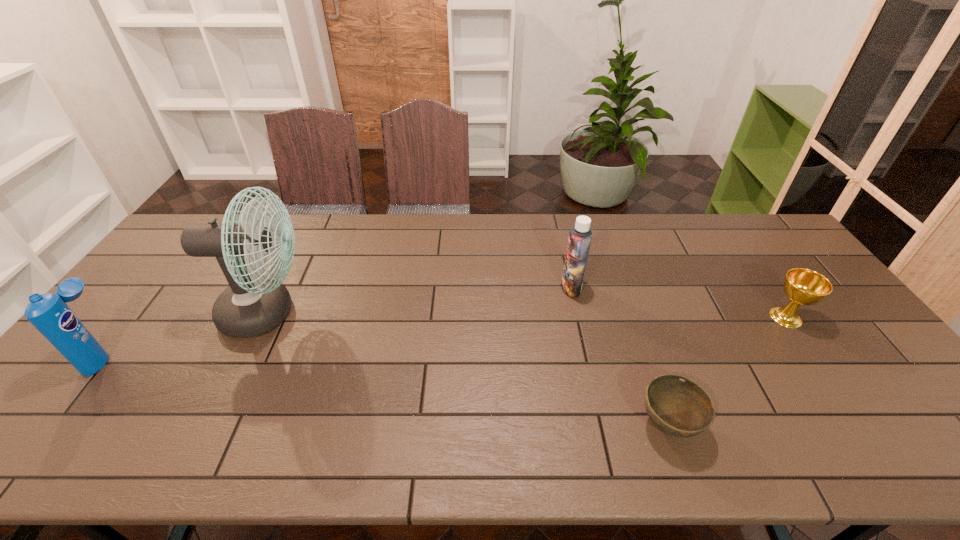
Identify the location of vacant position at the far edge of the desktop. (676, 231).

In the image, there is a desktop. Where is `vacant space at the near edge`? The height and width of the screenshot is (540, 960). vacant space at the near edge is located at coordinates (319, 449).

Locate an element on the screen. vacant region at the left edge of the desktop is located at coordinates (167, 265).

Identify the location of vacant space at the right edge of the desktop. The height and width of the screenshot is (540, 960). (782, 270).

You are a GUI agent. You are given a task and a screenshot of the screen. Output one action in this format:
    pyautogui.click(x=<x>, y=<y>)
    Task: Click on the vacant space at the near left corner of the desktop
    The height and width of the screenshot is (540, 960).
    Given the screenshot: What is the action you would take?
    pyautogui.click(x=49, y=427)

Locate an element on the screen. This screenshot has width=960, height=540. vacant space at the far right corner of the desktop is located at coordinates (749, 244).

At what (x,y) coordinates should I click in order to perform the action: click on vacant region at the near right corner. Please return your answer as a coordinate pair (x, y). The width and height of the screenshot is (960, 540). Looking at the image, I should click on (912, 442).

You are a GUI agent. You are given a task and a screenshot of the screen. Output one action in this format:
    pyautogui.click(x=<x>, y=<y>)
    Task: Click on the vacant region between the second shortest object and the nearest object
    This screenshot has width=960, height=540.
    Given the screenshot: What is the action you would take?
    pyautogui.click(x=727, y=371)

Where is `empty location between the rightmost object and the fourth object from left to right`? This screenshot has height=540, width=960. empty location between the rightmost object and the fourth object from left to right is located at coordinates (727, 371).

Locate an element on the screen. vacant space that is in between the farther shampoo and the chalice is located at coordinates (679, 302).